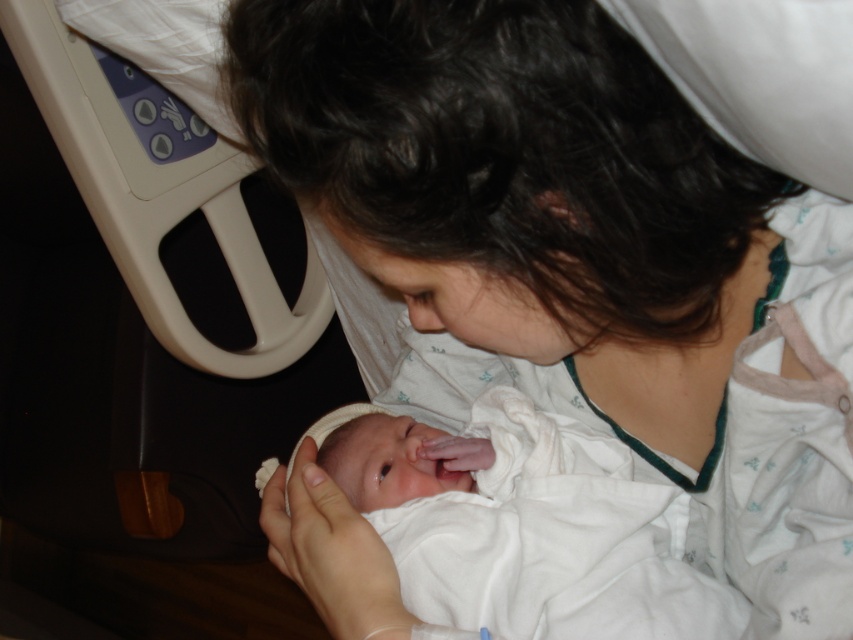
Question: Which point is closer to the camera?

Choices:
 (A) white soft cloth at center
 (B) white fabric at center

Answer: (B)

Question: Does white fabric at center have a smaller size compared to white soft cloth at center?

Choices:
 (A) yes
 (B) no

Answer: (B)

Question: Is white fabric at center wider than white soft cloth at center?

Choices:
 (A) no
 (B) yes

Answer: (B)

Question: Which point is farther from the camera taking this photo?

Choices:
 (A) (723, 616)
 (B) (271, 493)

Answer: (B)

Question: Which of the following is the farthest from the observer?

Choices:
 (A) white soft cloth at center
 (B) white fabric at center

Answer: (A)

Question: Is white fabric at center above white soft cloth at center?

Choices:
 (A) no
 (B) yes

Answer: (B)